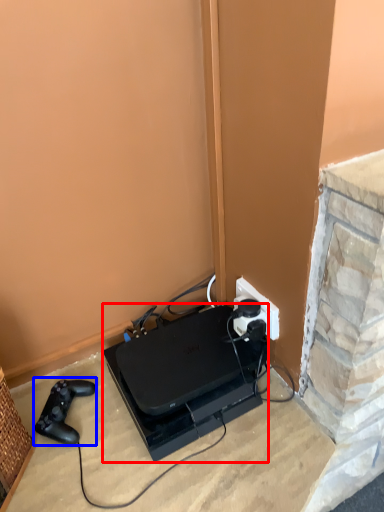
Question: Among these objects, which one is nearest to the camera, appliance (highlighted by a red box) or game controller (highlighted by a blue box)?

Choices:
 (A) appliance
 (B) game controller

Answer: (A)